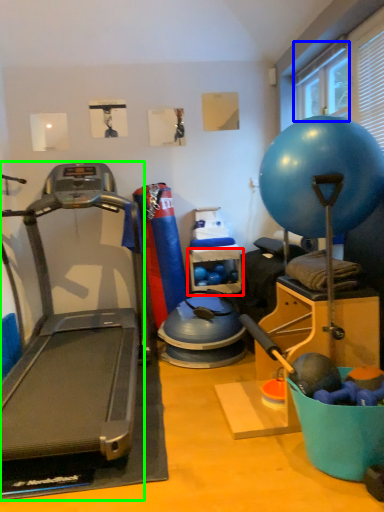
Question: Which is farther away from shelf (highlighted by a red box)? window screen (highlighted by a blue box) or treadmill (highlighted by a green box)?

Choices:
 (A) window screen
 (B) treadmill

Answer: (A)